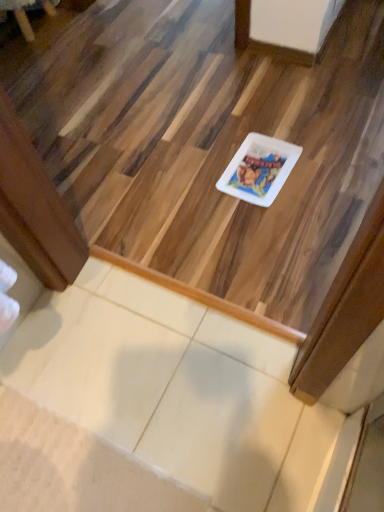
I want to click on vacant point to the right of white glossy plate at center, so click(327, 161).